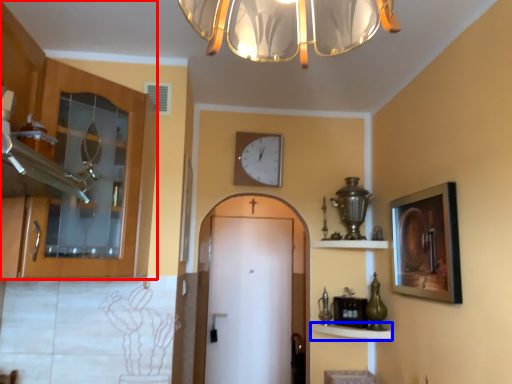
Question: Which of the following is the closest to the observer, cabinetry (highlighted by a red box) or shelf (highlighted by a blue box)?

Choices:
 (A) cabinetry
 (B) shelf

Answer: (A)